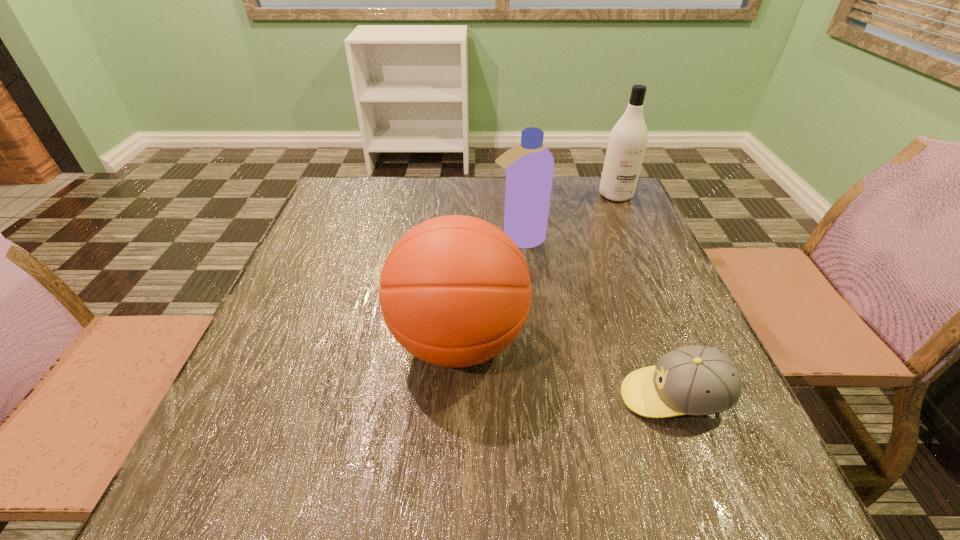
Where is `the farther shampoo`? This screenshot has height=540, width=960. the farther shampoo is located at coordinates (628, 139).

This screenshot has height=540, width=960. In order to click on the right shampoo in this screenshot , I will do `click(628, 139)`.

In order to click on the nearer shampoo in this screenshot , I will do `click(529, 166)`.

Where is `the third nearest object`? the third nearest object is located at coordinates (529, 166).

At what (x,y) coordinates should I click in order to perform the action: click on basketball. Please return your answer as a coordinate pair (x, y). This screenshot has width=960, height=540. Looking at the image, I should click on (455, 291).

Where is `baseball cap`? The image size is (960, 540). baseball cap is located at coordinates (695, 380).

Where is `free location located 0.310m on the front-facing side of the farthest object`? free location located 0.310m on the front-facing side of the farthest object is located at coordinates (653, 277).

Where is `free space located 0.240m on the right of the nearer shampoo`? The height and width of the screenshot is (540, 960). free space located 0.240m on the right of the nearer shampoo is located at coordinates (641, 238).

You are a GUI agent. You are given a task and a screenshot of the screen. Output one action in this format:
    pyautogui.click(x=<x>, y=<y>)
    Task: Click on the blank space located on the left of the basketball
    
    Given the screenshot: What is the action you would take?
    pyautogui.click(x=354, y=341)

I want to click on vacant space located 0.310m on the front-facing side of the shortest object, so click(x=441, y=397).